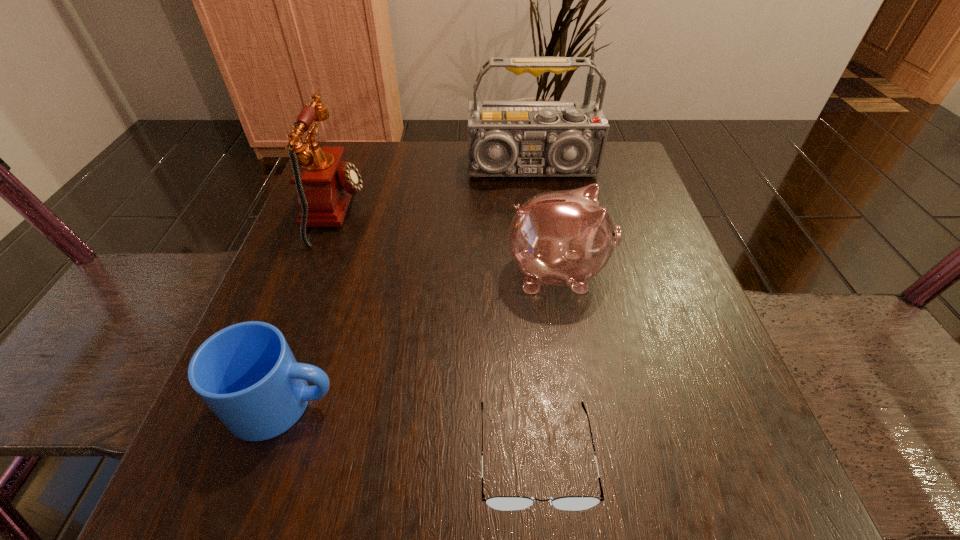
You are a GUI agent. You are given a task and a screenshot of the screen. Output one action in this format:
    pyautogui.click(x=<x>, y=<y>)
    Task: Click on the free space at the left edge of the desktop
    Image resolution: width=960 pixels, height=540 pixels.
    Given the screenshot: What is the action you would take?
    pyautogui.click(x=319, y=414)

Find the location of a particular element. The image size is (960, 540). blank area at the right edge is located at coordinates (669, 333).

Locate an element on the screen. The width and height of the screenshot is (960, 540). vacant space at the near right corner of the desktop is located at coordinates tap(682, 455).

At what (x,y) coordinates should I click in order to perform the action: click on free space between the piggy bank and the telephone. Please return your answer as a coordinate pair (x, y). Looking at the image, I should click on (446, 242).

You are a GUI agent. You are given a task and a screenshot of the screen. Output one action in this format:
    pyautogui.click(x=<x>, y=<y>)
    Task: Click on the vacant region between the shortest object and the telephone
    The width and height of the screenshot is (960, 540).
    Given the screenshot: What is the action you would take?
    pyautogui.click(x=436, y=334)

Locate an element on the screen. free space between the mug and the radio receiver is located at coordinates (408, 288).

Locate an element on the screen. This screenshot has width=960, height=540. vacant space that's between the spectacles and the second shortest object is located at coordinates (410, 429).

The image size is (960, 540). What are the coordinates of `free space between the telephone and the radio receiver` in the screenshot? It's located at (434, 192).

Locate an element on the screen. vacant space that's between the third tallest object and the spectacles is located at coordinates (546, 363).

Image resolution: width=960 pixels, height=540 pixels. I want to click on free spot between the tallest object and the mug, so click(x=408, y=288).